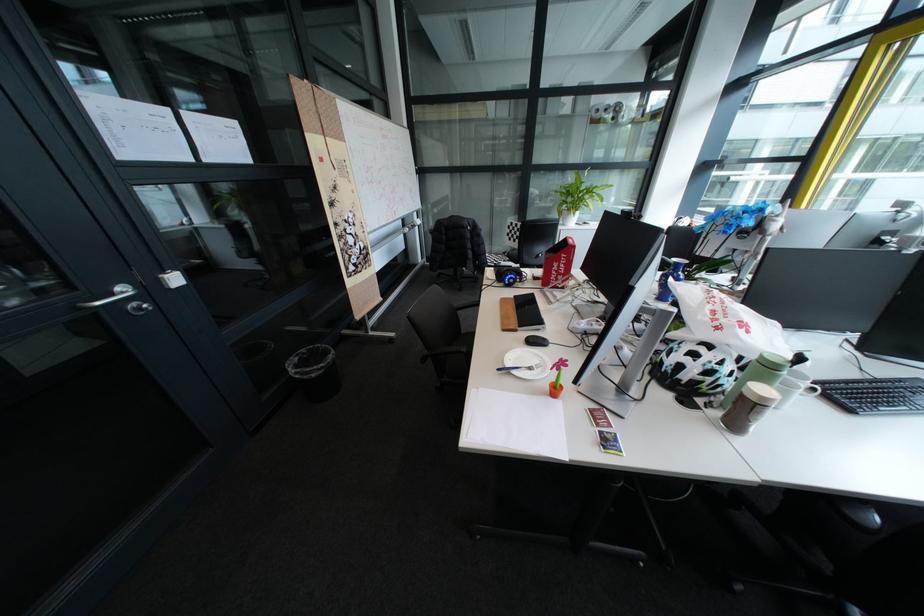
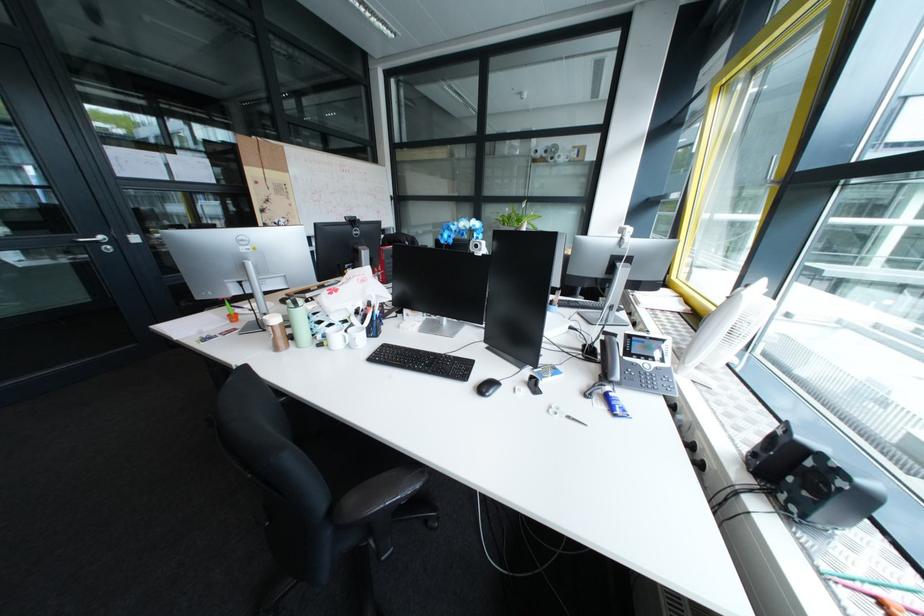
Question: I am providing you with two images of the same scene from different viewpoints. Please identify which objects are invisible in image2.

Choices:
 (A) white handled scissors
 (B) silver door handle
 (C) black computer mouse
 (D) copier side panel

Answer: (C)